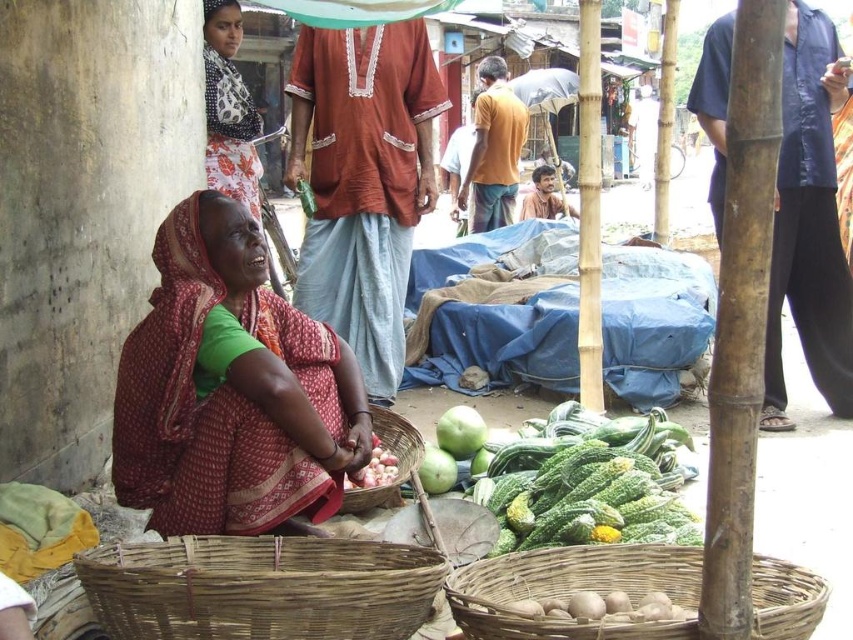
Can you confirm if reddish-brown fabric at center is smaller than brown textured shirt at center?

Yes, reddish-brown fabric at center is smaller than brown textured shirt at center.

Is reddish-brown fabric at center to the left of brown textured shirt at center from the viewer's perspective?

Correct, you'll find reddish-brown fabric at center to the left of brown textured shirt at center.

This screenshot has height=640, width=853. Describe the element at coordinates (231, 392) in the screenshot. I see `reddish-brown fabric at center` at that location.

The image size is (853, 640). What are the coordinates of `reddish-brown fabric at center` in the screenshot? It's located at (231, 392).

Can you confirm if brown woven basket at lower center is positioned below green rough gourds at lower center?

Correct, brown woven basket at lower center is located below green rough gourds at lower center.

Is brown woven basket at lower center bigger than green rough gourds at lower center?

No, brown woven basket at lower center is not bigger than green rough gourds at lower center.

Describe the element at coordinates (260, 588) in the screenshot. I see `brown woven basket at lower center` at that location.

The width and height of the screenshot is (853, 640). I want to click on brown woven basket at lower center, so click(x=260, y=588).

Is woven brown basket at lower center to the right of smooth brown garlic at center from the viewer's perspective?

Yes, woven brown basket at lower center is to the right of smooth brown garlic at center.

Is woven brown basket at lower center smaller than smooth brown garlic at center?

No, woven brown basket at lower center is not smaller than smooth brown garlic at center.

Image resolution: width=853 pixels, height=640 pixels. I want to click on woven brown basket at lower center, so pos(573,589).